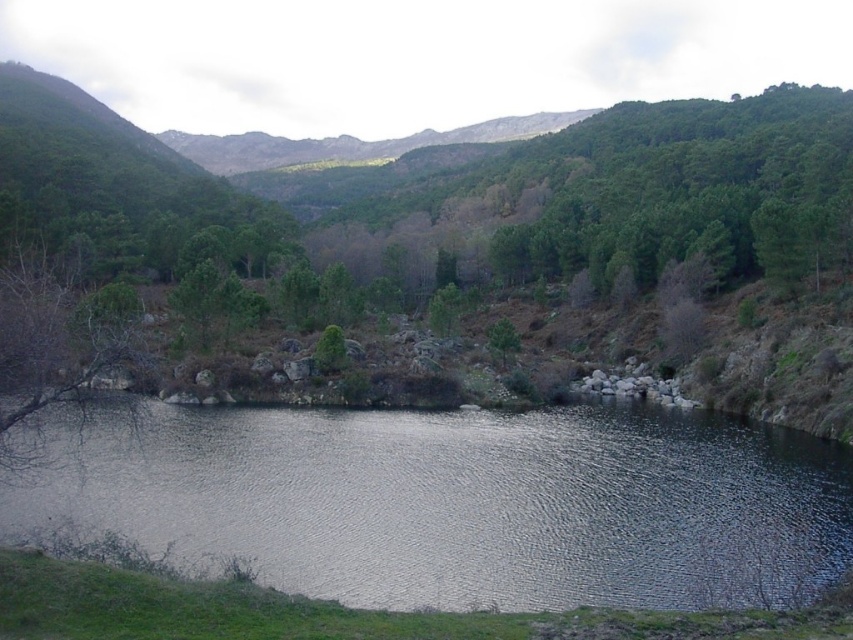
Can you confirm if reflective water at center is smaller than green matte tree at center?

Actually, reflective water at center might be larger than green matte tree at center.

Who is taller, reflective water at center or green matte tree at center?

With more height is reflective water at center.

Is point (399, 484) farther from viewer compared to point (490, 340)?

No, (399, 484) is closer to viewer.

Find the location of `reflective water at center`. reflective water at center is located at coordinates (462, 500).